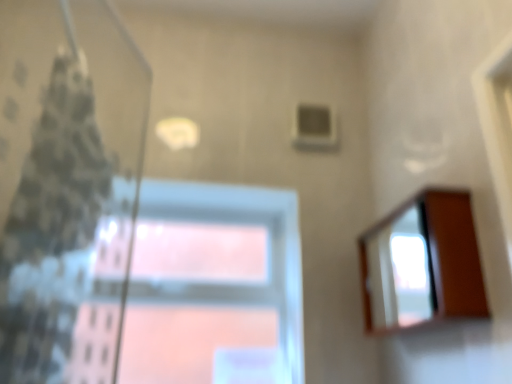
Question: Is wooden mirror at right bigger than patterned fabric shower curtain at left?

Choices:
 (A) no
 (B) yes

Answer: (A)

Question: Considering the relative positions of wooden mirror at right and patterned fabric shower curtain at left in the image provided, is wooden mirror at right to the right of patterned fabric shower curtain at left from the viewer's perspective?

Choices:
 (A) no
 (B) yes

Answer: (B)

Question: Does wooden mirror at right have a greater height compared to patterned fabric shower curtain at left?

Choices:
 (A) no
 (B) yes

Answer: (A)

Question: Can you confirm if wooden mirror at right is shorter than patterned fabric shower curtain at left?

Choices:
 (A) yes
 (B) no

Answer: (A)

Question: Is wooden mirror at right facing towards patterned fabric shower curtain at left?

Choices:
 (A) yes
 (B) no

Answer: (A)

Question: Is wooden mirror at right beside patterned fabric shower curtain at left?

Choices:
 (A) yes
 (B) no

Answer: (B)

Question: Does wooden mirror at right have a lesser height compared to transparent glass window at center?

Choices:
 (A) no
 (B) yes

Answer: (B)

Question: Is wooden mirror at right further to the viewer compared to transparent glass window at center?

Choices:
 (A) no
 (B) yes

Answer: (A)

Question: Can you confirm if wooden mirror at right is thinner than transparent glass window at center?

Choices:
 (A) no
 (B) yes

Answer: (A)

Question: Is wooden mirror at right at the right side of transparent glass window at center?

Choices:
 (A) no
 (B) yes

Answer: (B)

Question: Does wooden mirror at right have a greater width compared to transparent glass window at center?

Choices:
 (A) yes
 (B) no

Answer: (A)

Question: Could you tell me if wooden mirror at right is facing transparent glass window at center?

Choices:
 (A) yes
 (B) no

Answer: (B)

Question: Considering the relative positions of patterned fabric shower curtain at left and transparent glass window at center in the image provided, is patterned fabric shower curtain at left to the left of transparent glass window at center from the viewer's perspective?

Choices:
 (A) yes
 (B) no

Answer: (A)